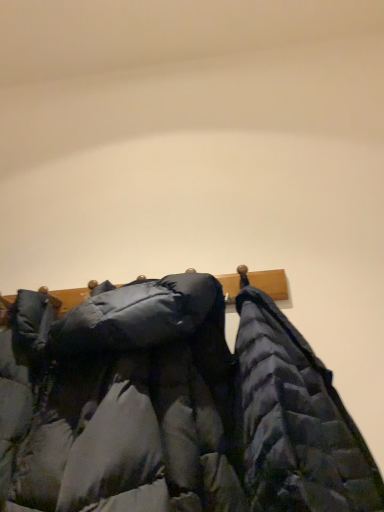
The height and width of the screenshot is (512, 384). Find the location of `matte black jacket at center`. matte black jacket at center is located at coordinates (172, 407).

The height and width of the screenshot is (512, 384). Describe the element at coordinates (172, 407) in the screenshot. I see `matte black jacket at center` at that location.

This screenshot has width=384, height=512. In order to click on matte black jacket at center in this screenshot , I will do `click(172, 407)`.